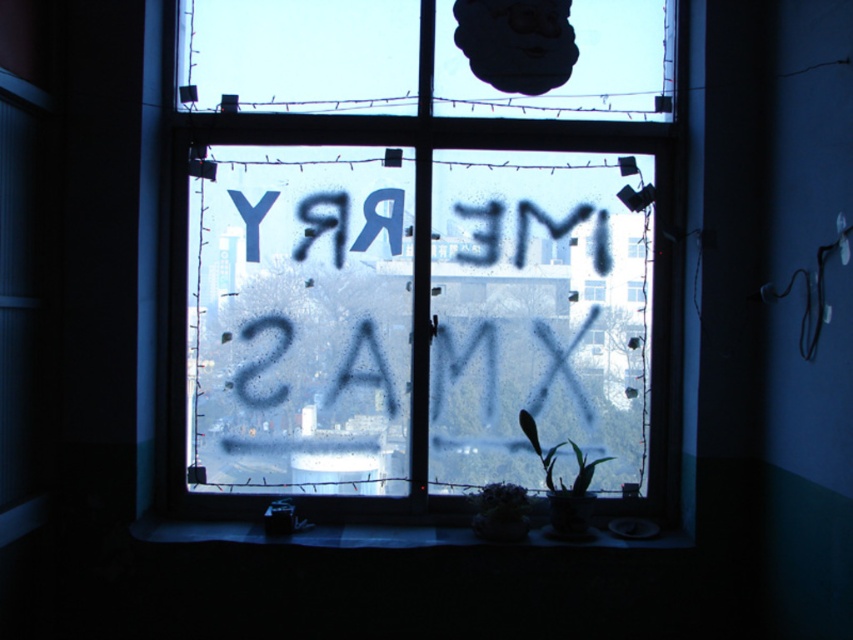
You are an interior designer planning to place a large potted plant in the room. The plant requires a spot where it won not block the view of the frosted glass window at center. Given that the smooth concrete surface at lower center is the only flat area available, will the plant fit there without obscuring the window?

The frosted glass window at center is bigger than the smooth concrete surface at lower center. Since the smooth concrete surface at lower center is smaller, placing the plant there would not block the entire window, but part of the window might still be obscured depending on the plant size.

You are standing in the room and want to locate the frosted glass window at center. According to the coordinates provided, where should you look relative to the room?

The frosted glass window at center is located at the coordinates point (415, 262), which is near the center of the room.